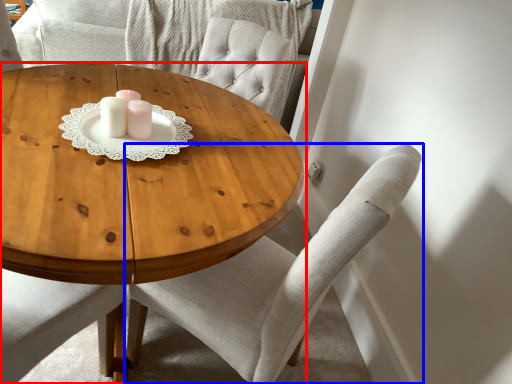
Question: Which object appears farthest to the camera in this image, coffee table (highlighted by a red box) or chair (highlighted by a blue box)?

Choices:
 (A) coffee table
 (B) chair

Answer: (B)